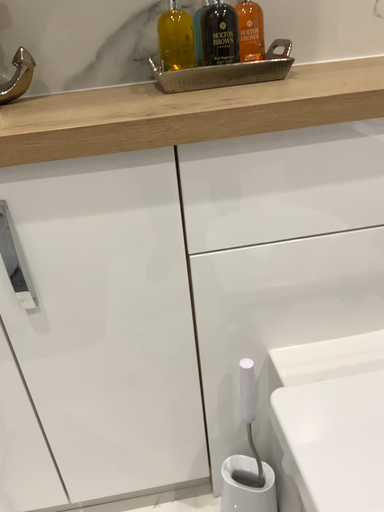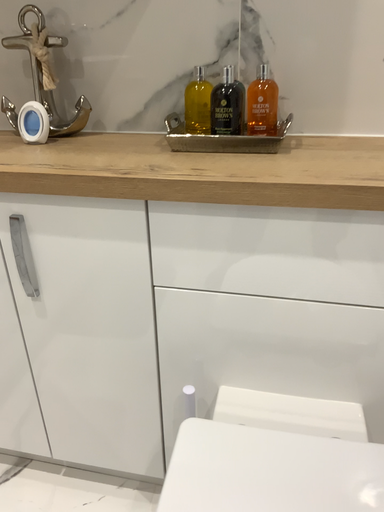
Question: Which way did the camera rotate in the video?

Choices:
 (A) rotated right
 (B) rotated left

Answer: (B)